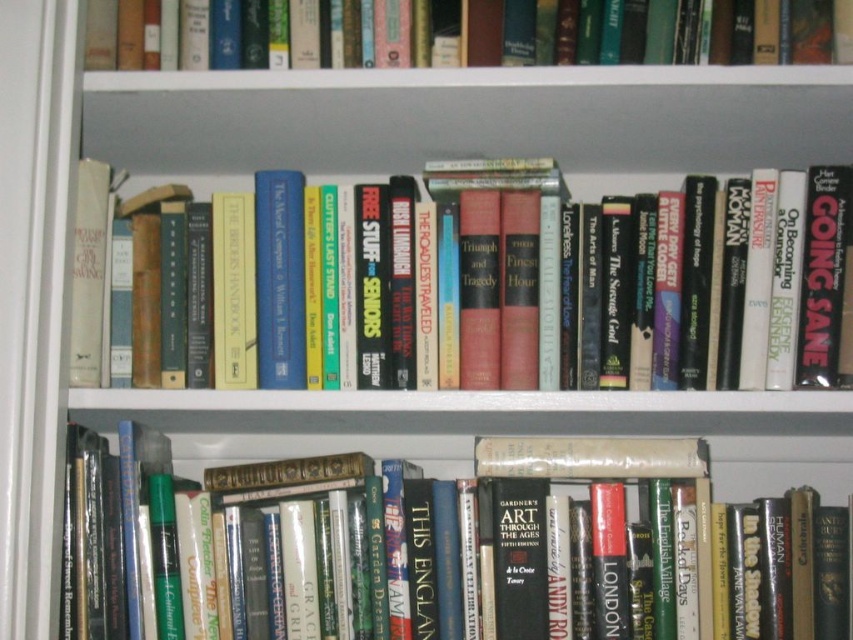
Question: Which is farther from the hardcover book at upper center?

Choices:
 (A) hardcover book at lower center
 (B) hardcover book at center

Answer: (A)

Question: Observing the image, what is the correct spatial positioning of hardcover book at lower center in reference to hardcover book at upper center?

Choices:
 (A) left
 (B) right

Answer: (A)

Question: Considering the relative positions of hardcover book at center and hardcover book at upper center in the image provided, where is hardcover book at center located with respect to hardcover book at upper center?

Choices:
 (A) left
 (B) right

Answer: (B)

Question: Which object appears closest to the camera in this image?

Choices:
 (A) hardcover book at lower center
 (B) hardcover book at center

Answer: (A)

Question: Which of the following is the farthest from the observer?

Choices:
 (A) hardcover book at upper center
 (B) hardcover book at center

Answer: (A)

Question: Is hardcover book at lower center smaller than hardcover book at upper center?

Choices:
 (A) yes
 (B) no

Answer: (B)